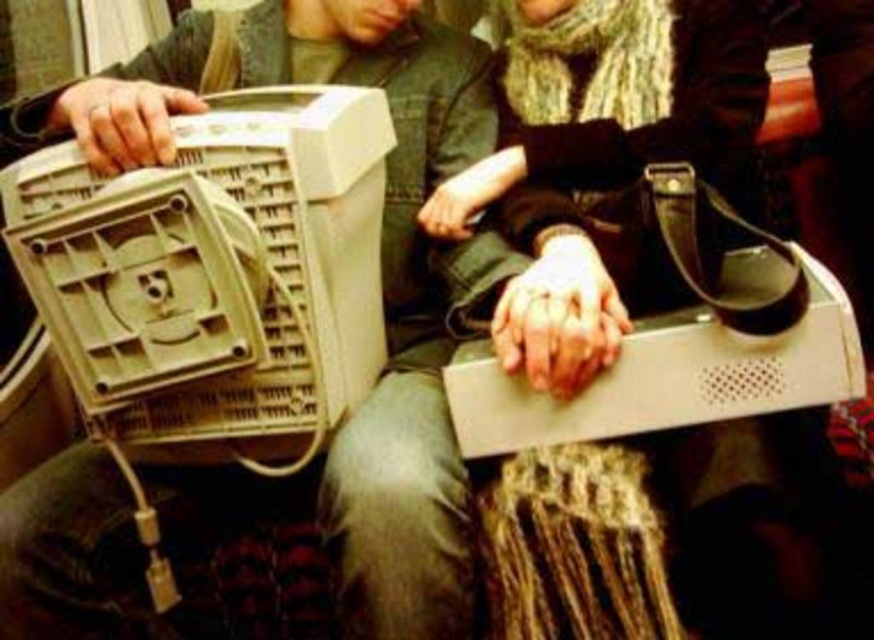
You are a technician trying to place a new component between the matte plastic monitor at left and the beige plastic computer at left. The component requires at least 8 centimeters of space to fit properly. Based on the scene, can you determine if there is enough space between them?

The matte plastic monitor at left and beige plastic computer at left are 7.52 centimeters apart from each other, so there is not enough space to fit the component which requires at least 8 centimeters.

You are an antique electronics collector examining two items in the scene. You need to determine which item is taller. The items are the matte plastic monitor at left and the beige plastic computer at left. Which one is taller?

The matte plastic monitor at left is taller than the beige plastic computer at left according to the description.

You are an engineer inspecting two devices in a vintage electronics workshop. You see the matte plastic monitor at left and the beige plastic computer at left. Which device is closer to you?

The matte plastic monitor at left is closer to you because it is further to the viewer than the beige plastic computer at left.